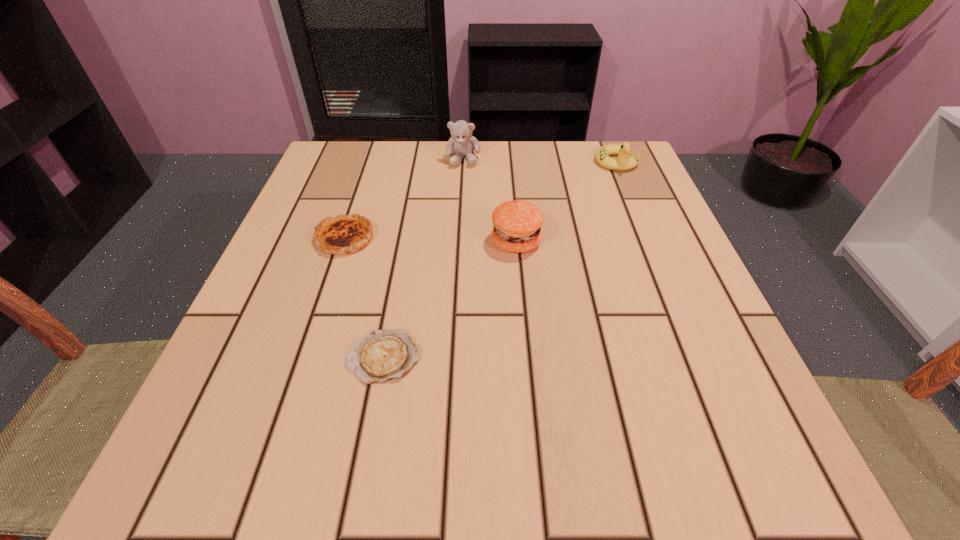
Image resolution: width=960 pixels, height=540 pixels. What are the coordinates of `free region located 0.230m on the face of the duckling` in the screenshot? It's located at (650, 242).

I want to click on free spot located 0.230m on the right of the farther quiche, so click(495, 238).

What are the coordinates of `free space located on the right of the shorter quiche` in the screenshot? It's located at (522, 357).

Locate an element on the screen. The height and width of the screenshot is (540, 960). teddy bear present at the far edge is located at coordinates (462, 143).

The image size is (960, 540). Find the location of `duckling at the far edge`. duckling at the far edge is located at coordinates (628, 158).

Image resolution: width=960 pixels, height=540 pixels. I want to click on object at the left edge, so click(345, 234).

I want to click on object located at the right edge, so click(x=628, y=158).

Identify the location of object that is at the far right corner. The height and width of the screenshot is (540, 960). (628, 158).

Where is `vacant space at the far edge of the desktop`? The height and width of the screenshot is (540, 960). vacant space at the far edge of the desktop is located at coordinates (477, 191).

You are a GUI agent. You are given a task and a screenshot of the screen. Output one action in this format:
    pyautogui.click(x=<x>, y=<y>)
    Task: Click on the vacant space at the left edge
    Image resolution: width=960 pixels, height=540 pixels.
    Given the screenshot: What is the action you would take?
    pyautogui.click(x=316, y=327)